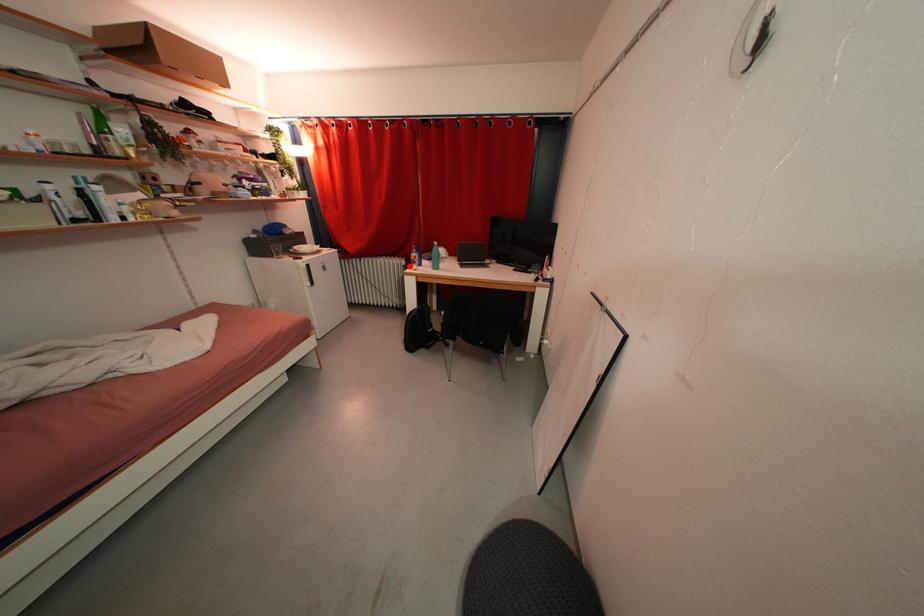
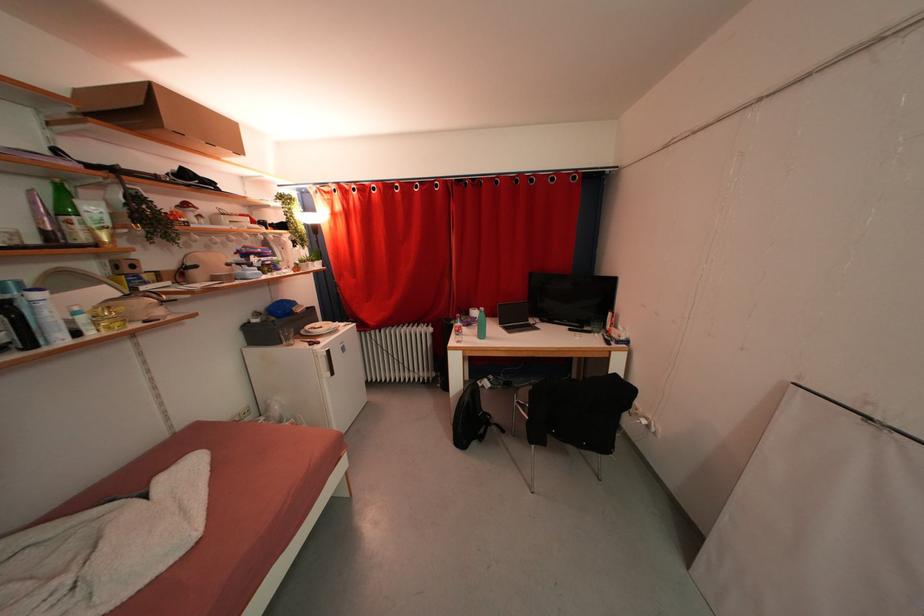
Locate, in the second image, the point that corresponds to the highlighted location in the first image.

(436, 333)